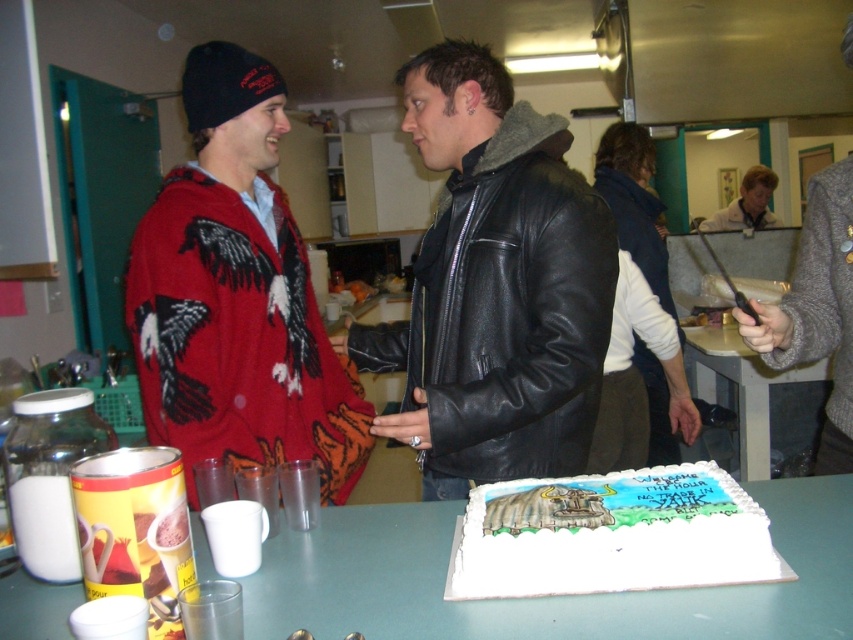
Based on the photo, does white fondant cake at center appear on the left side of white fleece vest at center?

Correct, you'll find white fondant cake at center to the left of white fleece vest at center.

Can you confirm if white fondant cake at center is positioned below white fleece vest at center?

Indeed, white fondant cake at center is positioned under white fleece vest at center.

Is point (531, 509) positioned after point (614, 163)?

No, it is not.

Identify the location of white fondant cake at center. (608, 534).

Which is above, black leather jacket at center or gray sweater at right?

black leather jacket at center is higher up.

Between black leather jacket at center and gray sweater at right, which one appears on the right side from the viewer's perspective?

Positioned to the right is gray sweater at right.

Does point (457, 184) come closer to viewer compared to point (850, 28)?

No, (457, 184) is behind (850, 28).

Locate an element on the screen. This screenshot has width=853, height=640. black leather jacket at center is located at coordinates (495, 285).

Does black leather jacket at center have a lesser height compared to white fondant cake at center?

Incorrect, black leather jacket at center's height does not fall short of white fondant cake at center's.

This screenshot has height=640, width=853. What do you see at coordinates (495, 285) in the screenshot? I see `black leather jacket at center` at bounding box center [495, 285].

Who is more forward, (541, 212) or (471, 563)?

Point (471, 563) is in front.

The image size is (853, 640). I want to click on black leather jacket at center, so click(495, 285).